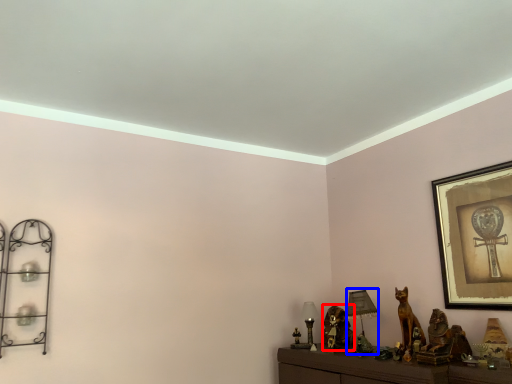
Question: Which point is closer to the camera, animal (highlighted by a red box) or table lamp (highlighted by a blue box)?

Choices:
 (A) animal
 (B) table lamp

Answer: (B)